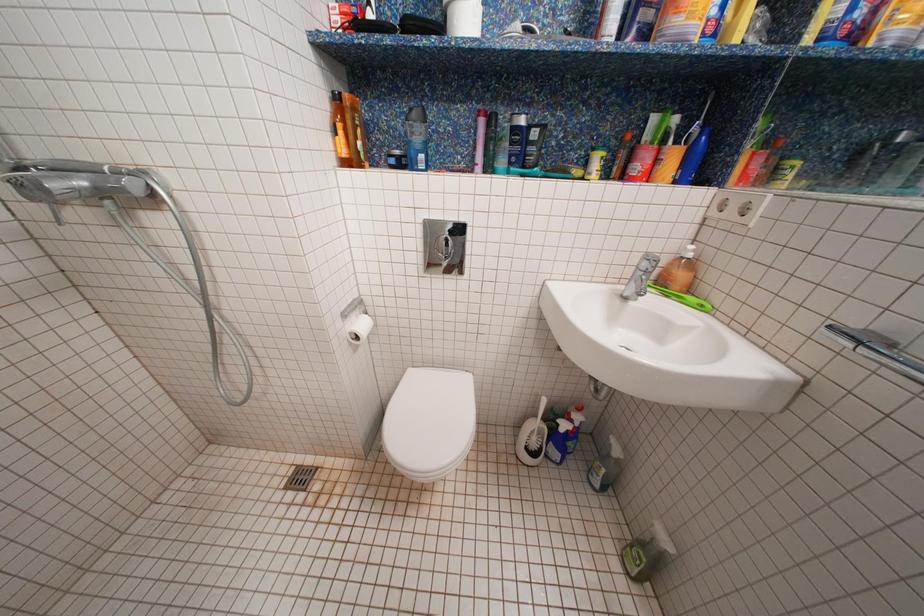
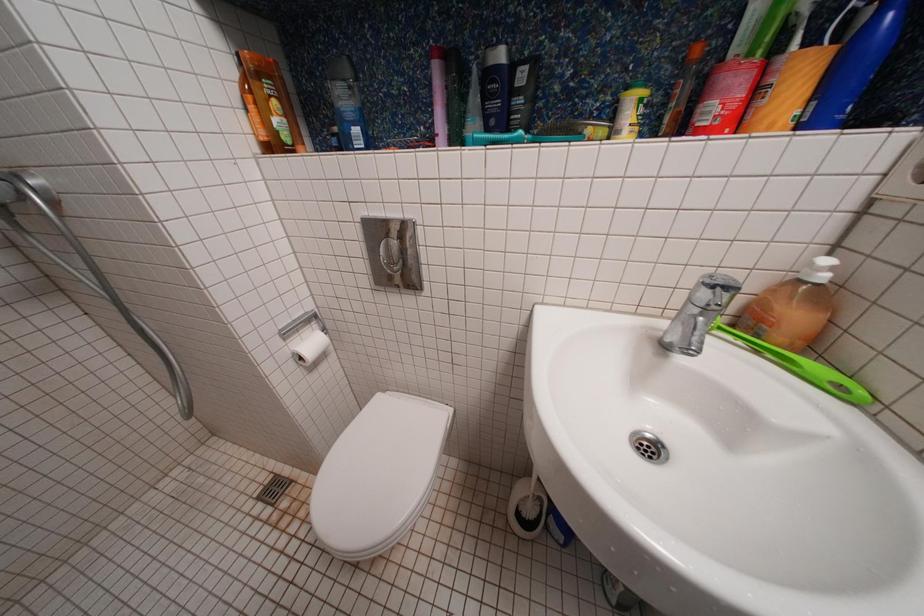
What movement of the cameraman would produce the second image?

The cameraman walked toward right, forward.